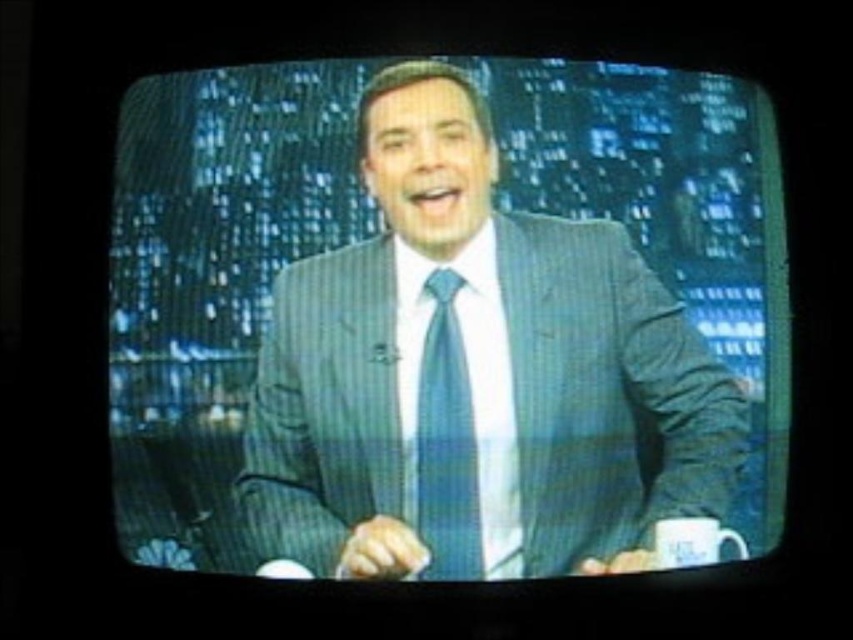
You are a character in a video game that can move freely in the scene. You want to reach the point at coordinates point (352,348) first before going to point (431,332). Since both points are on the CRT screen, which direction should you move first from your current position at the center of the screen to reach the first point efficiently?

Since point (352,348) is in front of point (431,332), you should move towards the direction closer to the front of point (352,348) first to reach it before the other point.

Based on the photo, you are a fashion designer analyzing a TV image of a man in a blue pinstripe suit at center and a blue textured tie at center. Which clothing item is positioned closer to the viewer?

The blue pinstripe suit at center is closer to the viewer than the blue textured tie at center.